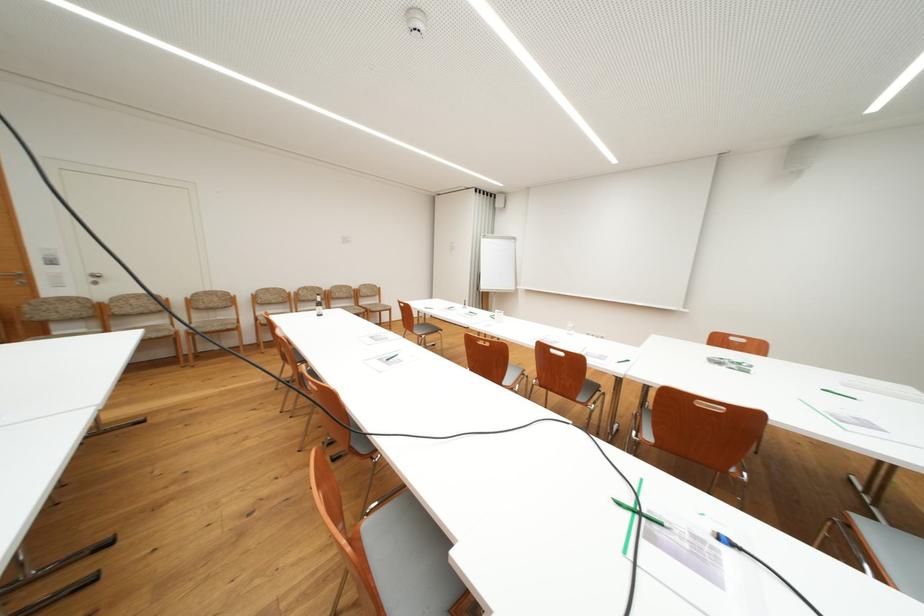
The image size is (924, 616). What are the coordinates of `white flip chart` in the screenshot? It's located at (687, 546).